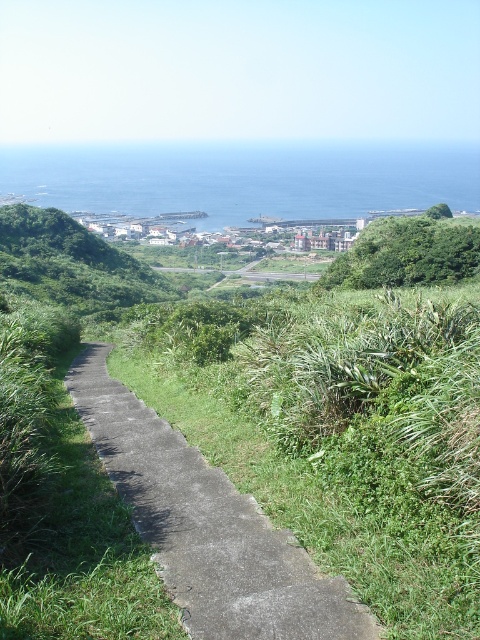
You are standing at the top of the hill overlooking the coastal landscape. You notice a point marked at coordinates (242, 179). What is located at this point?

The blue water at upper center is located at point (242, 179).

In the scene shown: You are a hiker standing on the pathway in the coastal landscape. You see the green grassy hillside at center and the green leafy bush at upper right. Which of these two objects is positioned higher in the scene?

The green grassy hillside at center is located above the green leafy bush at upper right, so it is positioned higher in the scene.

You are standing at the top of a hill and want to reach the settlement below. You see the green grassy hillside at center. Based on its position, can you estimate how far down the hill you need to walk to reach the settlement?

The green grassy hillside at center is located at coordinates point (72, 262), which indicates it is positioned approximately 41.2 percent from the left edge and 15 percent from the top edge of the image. This suggests that the settlement is situated further down the slope, so you would need to descend about 15 percent of the hill from the top to reach it.